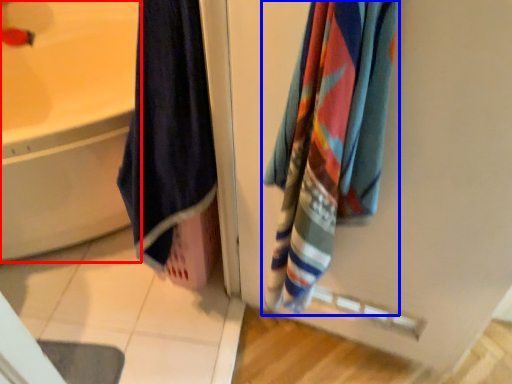
Question: Which point is further to the camera, bathtub (highlighted by a red box) or towel (highlighted by a blue box)?

Choices:
 (A) bathtub
 (B) towel

Answer: (A)